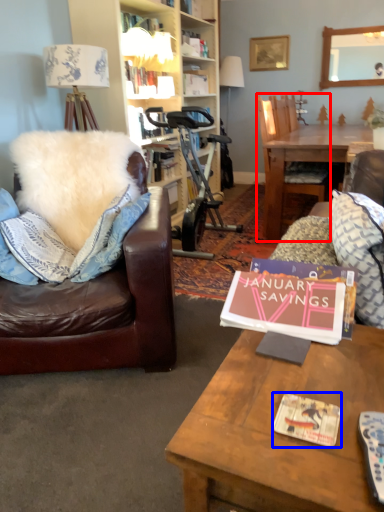
Question: Among these objects, which one is nearest to the camera, chair (highlighted by a red box) or magazine (highlighted by a blue box)?

Choices:
 (A) chair
 (B) magazine

Answer: (B)